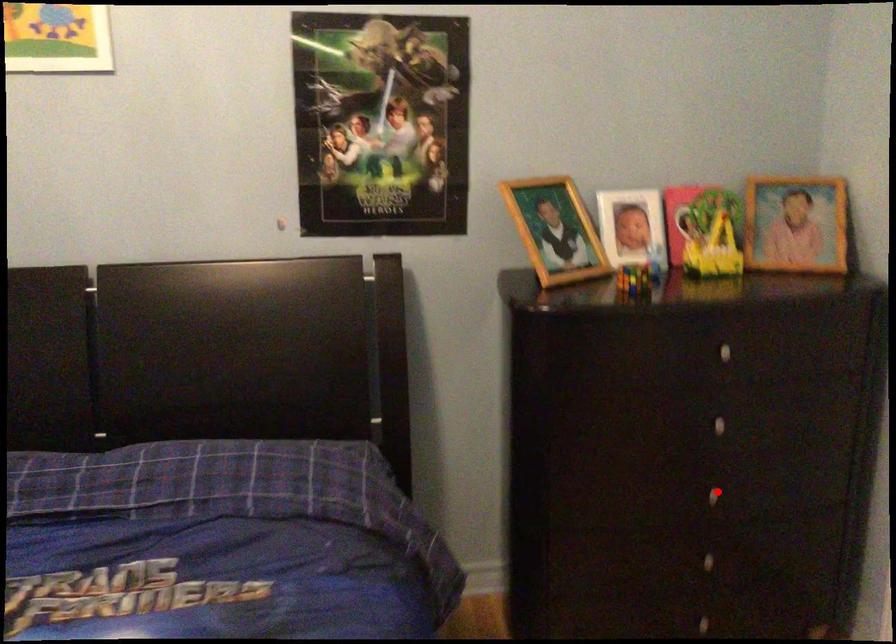
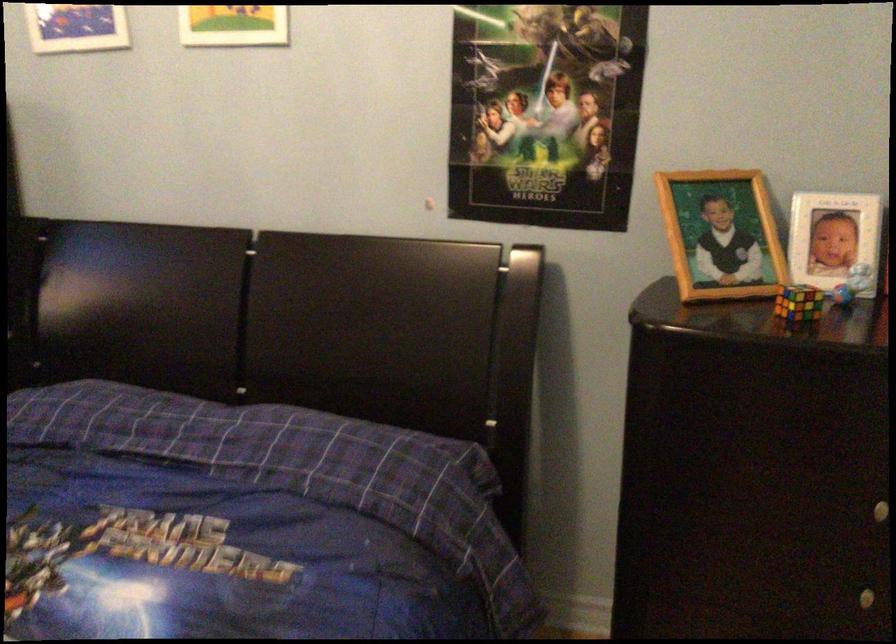
Find the pixel in the second image that matches the highlighted location in the first image.

(868, 597)